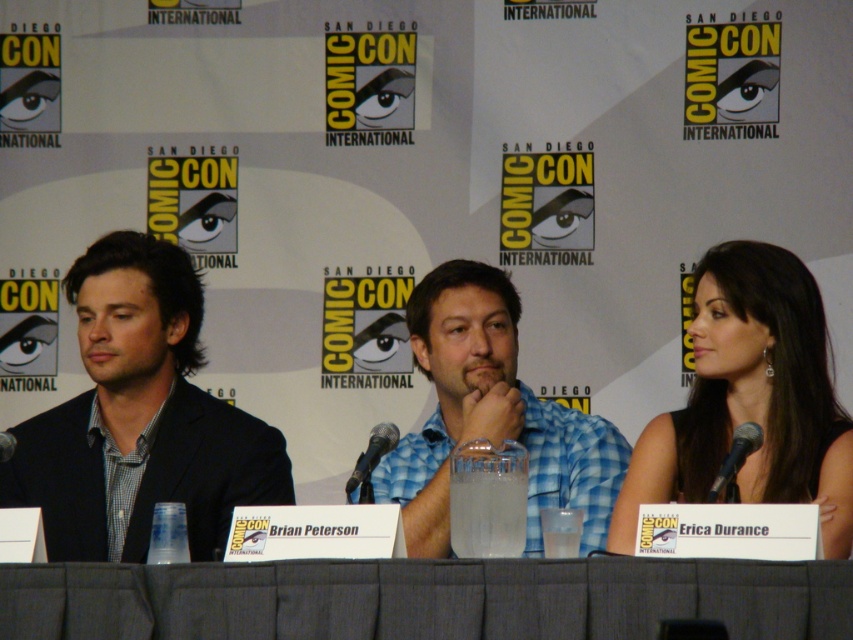
What are the coordinates of the gray fabric table at center in the image?

The gray fabric table at center is located at coordinates point [424,598].

You are a photographer at Comic Con trying to position yourself to capture both points of interest marked as point [85,605] and point [109,307]. Based on their positions, which point should you focus on first to ensure both are in frame?

Point [85,605] is in front of point [109,307], so you should focus on point [85,605] first to ensure both are in frame.